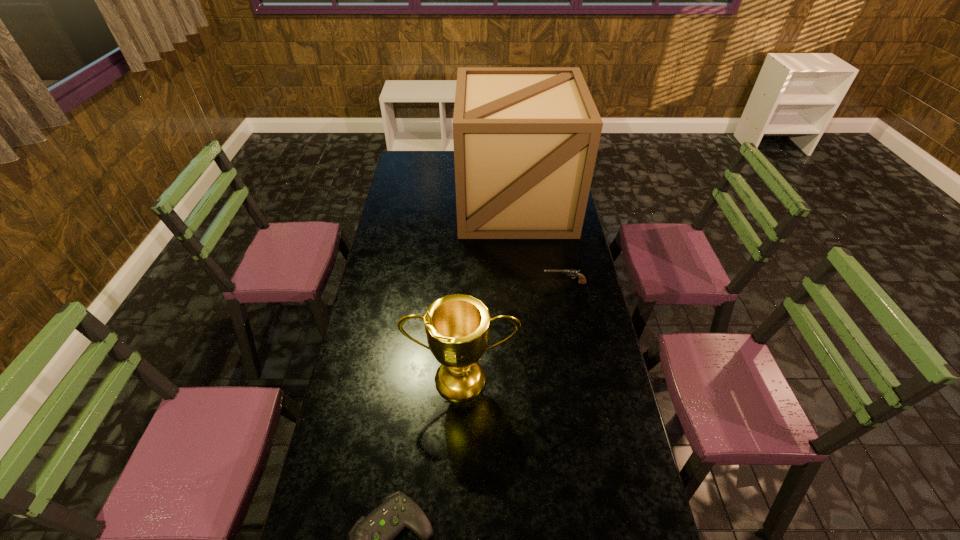
Identify the location of free region located 0.080m aiming along the barrel of the second farthest object. This screenshot has width=960, height=540. (523, 283).

The height and width of the screenshot is (540, 960). I want to click on object situated at the far edge, so click(526, 139).

The image size is (960, 540). In order to click on box located in the right edge section of the desktop in this screenshot , I will do `click(526, 139)`.

Where is `gun located at the right edge`? Image resolution: width=960 pixels, height=540 pixels. gun located at the right edge is located at coordinates (582, 280).

Locate an element on the screen. This screenshot has height=540, width=960. object that is at the far right corner is located at coordinates (526, 139).

The height and width of the screenshot is (540, 960). What are the coordinates of `vacant region at the far edge` in the screenshot? It's located at (443, 153).

Image resolution: width=960 pixels, height=540 pixels. I want to click on vacant space at the left edge of the desktop, so click(316, 502).

Where is `vacant space at the right edge`? The width and height of the screenshot is (960, 540). vacant space at the right edge is located at coordinates point(581,294).

I want to click on vacant area between the third tallest object and the second tallest object, so click(514, 331).

I want to click on free point between the box and the second shortest object, so click(x=540, y=243).